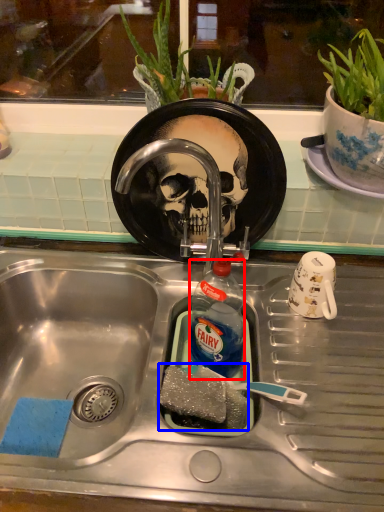
Question: Which point is closer to the camera, bottle (highlighted by a red box) or food (highlighted by a blue box)?

Choices:
 (A) bottle
 (B) food

Answer: (B)